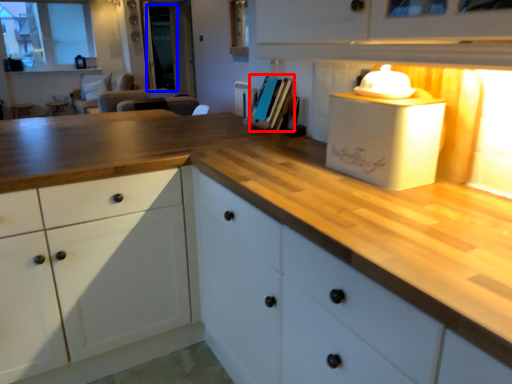
Question: Which point is further to the camera, book (highlighted by a red box) or glass door (highlighted by a blue box)?

Choices:
 (A) book
 (B) glass door

Answer: (B)